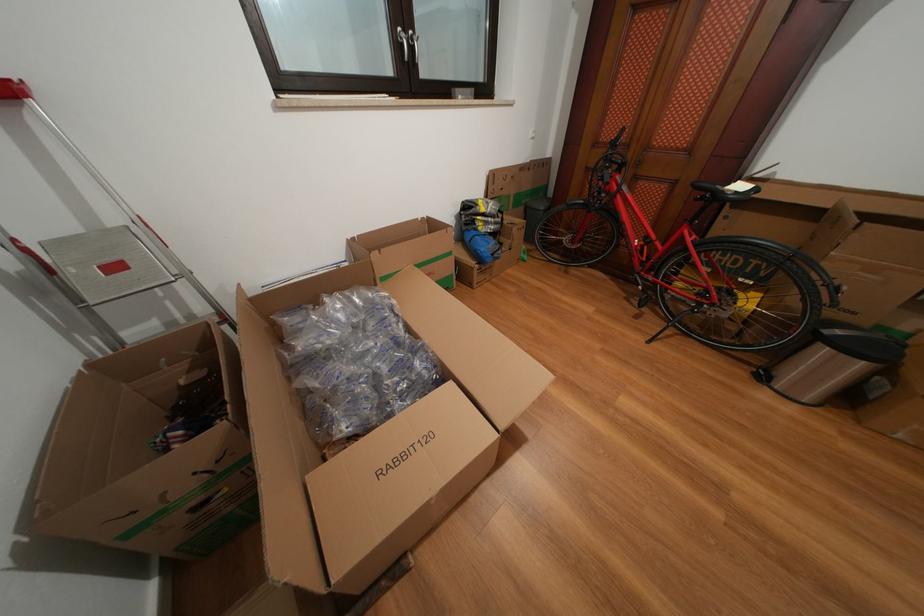
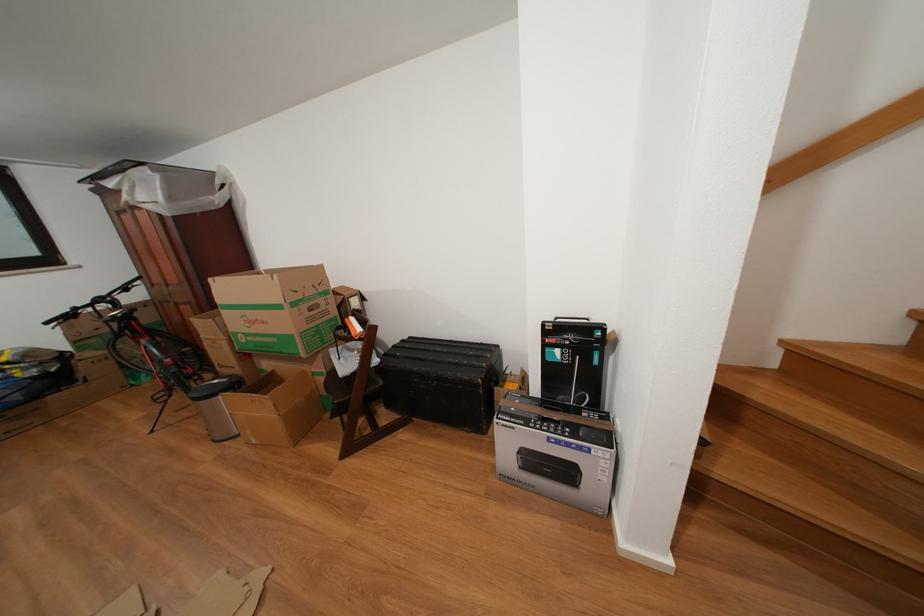
Locate, in the second image, the point that corresponds to [747,192] in the first image.

(126, 317)